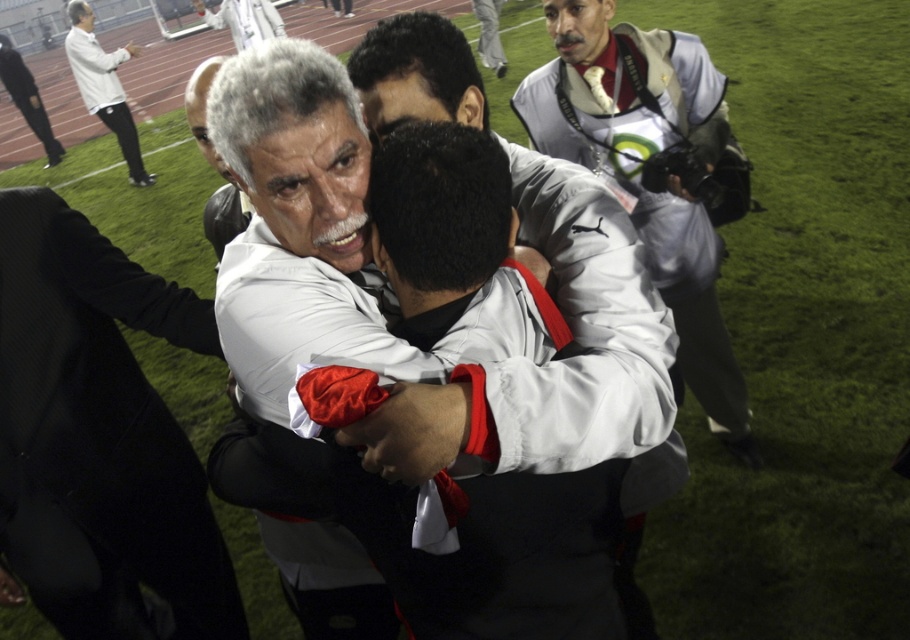
Can you confirm if white matte jacket at center is bigger than black suit at left?

Actually, white matte jacket at center might be smaller than black suit at left.

Who is positioned more to the right, white matte jacket at center or black suit at left?

white matte jacket at center is more to the right.

Measure the distance between point (291, 237) and camera.

They are 3.32 feet apart.

I want to click on white matte jacket at center, so click(299, 228).

Does white matte jacket at center appear on the left side of white matte jacket at upper center?

Yes, white matte jacket at center is to the left of white matte jacket at upper center.

Does point (261, 138) lie behind point (703, 280)?

No.

Who is more forward, (x=298, y=97) or (x=651, y=65)?

Point (x=298, y=97)

The image size is (910, 640). I want to click on white matte jacket at center, so click(299, 228).

Which is more to the right, black suit at center or white matte jacket at upper left?

black suit at center is more to the right.

Is black suit at center thinner than white matte jacket at upper left?

Yes.

The height and width of the screenshot is (640, 910). Describe the element at coordinates (100, 436) in the screenshot. I see `black suit at center` at that location.

This screenshot has width=910, height=640. What are the coordinates of `black suit at center` in the screenshot? It's located at (100, 436).